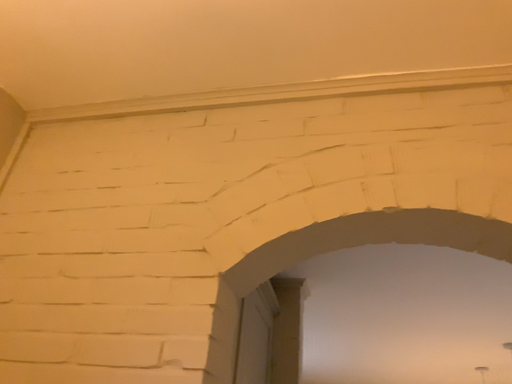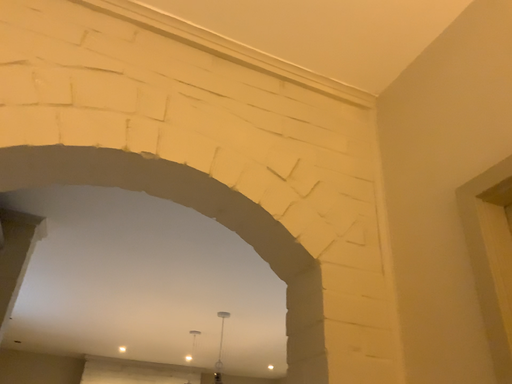
Question: How did the camera likely rotate when shooting the video?

Choices:
 (A) rotated right
 (B) rotated left

Answer: (A)